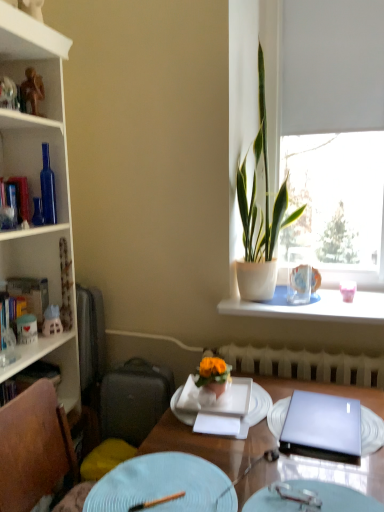
What are the coordinates of `free space between satin purple laptop at center and light blue ceramic plate at center, which is the 2th plate from back to front` in the screenshot? It's located at (254, 452).